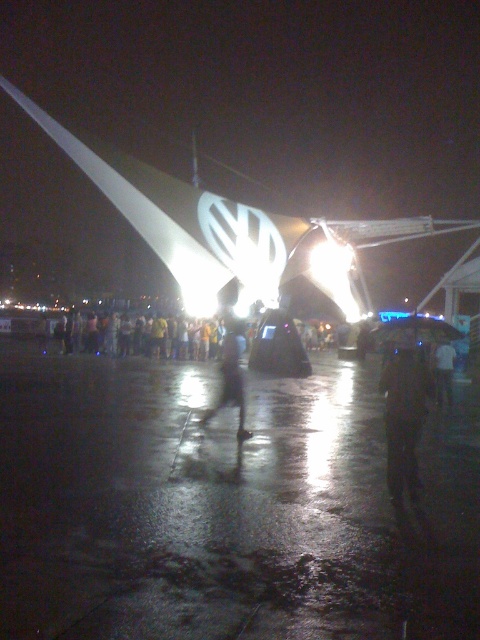
Question: Does transparent plastic umbrella at center appear over white matte shirt at center?

Choices:
 (A) yes
 (B) no

Answer: (A)

Question: Is yellow casual clothing at center positioned at the back of dark matte figure at center?

Choices:
 (A) yes
 (B) no

Answer: (A)

Question: Which object is positioned farthest from the black matte jacket at center?

Choices:
 (A) yellow casual clothing at center
 (B) transparent plastic umbrella at center

Answer: (A)

Question: Which is nearer to the transparent plastic umbrella at center?

Choices:
 (A) white matte shirt at center
 (B) black matte jacket at center
 (C) dark matte figure at center
 (D) yellow casual clothing at center

Answer: (B)

Question: Which object appears closest to the camera in this image?

Choices:
 (A) yellow casual clothing at center
 (B) black matte jacket at center
 (C) dark matte figure at center

Answer: (B)

Question: Can you confirm if black matte jacket at center is positioned below yellow casual clothing at center?

Choices:
 (A) yes
 (B) no

Answer: (A)